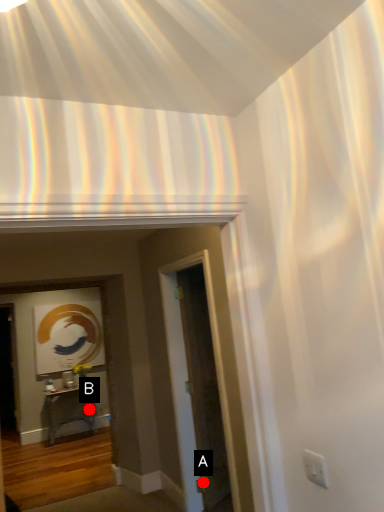
Question: Two points are circled on the image, labeled by A and B beside each circle. Which point is further to the camera?

Choices:
 (A) A is further
 (B) B is further

Answer: (B)